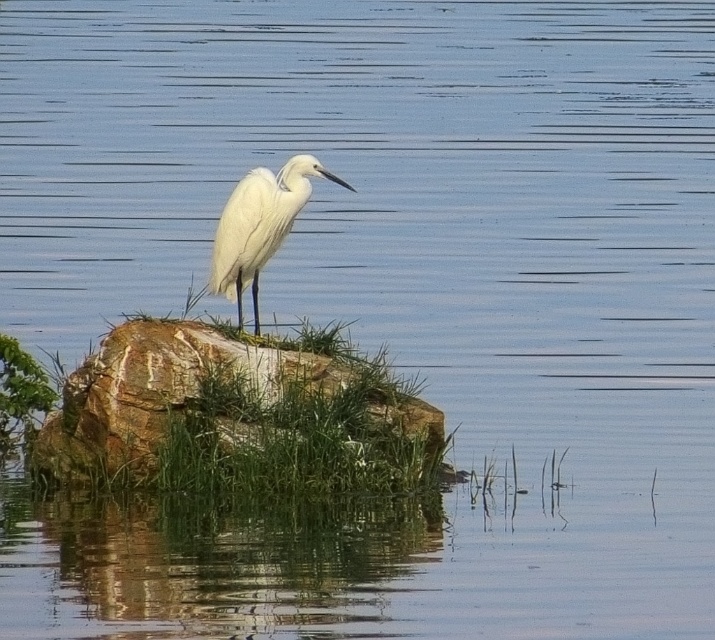
Question: Which of the following is the closest to the observer?

Choices:
 (A) brown rough rock at center
 (B) white feathered bird at center

Answer: (B)

Question: Is brown rough rock at center above white feathered bird at center?

Choices:
 (A) yes
 (B) no

Answer: (B)

Question: Which point appears farthest from the camera in this image?

Choices:
 (A) (337, 180)
 (B) (46, 429)

Answer: (B)

Question: Among these points, which one is farthest from the camera?

Choices:
 (A) (257, 244)
 (B) (162, 337)

Answer: (B)

Question: Does brown rough rock at center appear over white feathered bird at center?

Choices:
 (A) yes
 (B) no

Answer: (B)

Question: Does brown rough rock at center lie in front of white feathered bird at center?

Choices:
 (A) no
 (B) yes

Answer: (A)